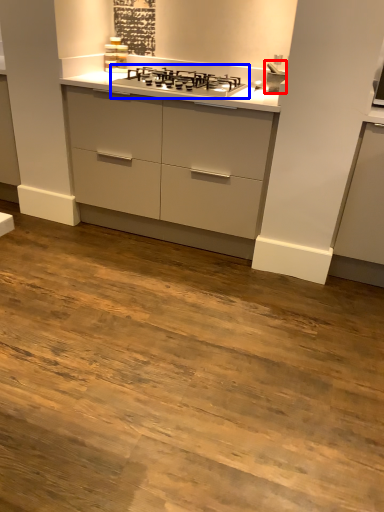
Question: Which object is closer to the camera taking this photo, sink (highlighted by a red box) or gas stove (highlighted by a blue box)?

Choices:
 (A) sink
 (B) gas stove

Answer: (B)